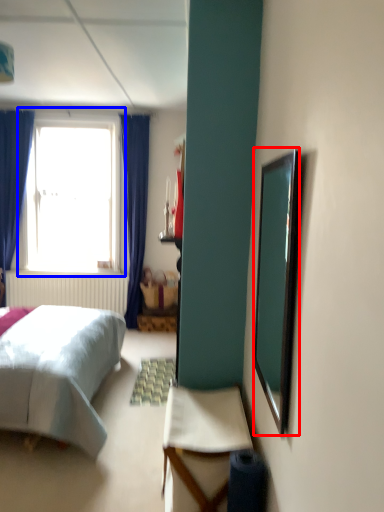
Question: Among these objects, which one is nearest to the camera, mirror (highlighted by a red box) or window (highlighted by a blue box)?

Choices:
 (A) mirror
 (B) window

Answer: (A)